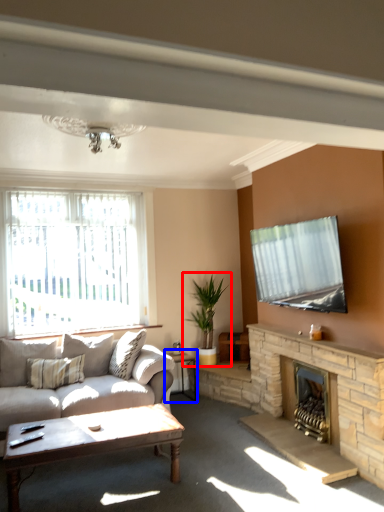
Question: Among these objects, which one is farthest to the camera, houseplant (highlighted by a red box) or table (highlighted by a blue box)?

Choices:
 (A) houseplant
 (B) table

Answer: (A)